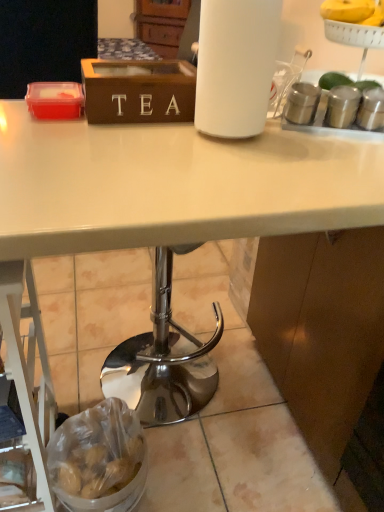
Question: From their relative heights in the image, would you say wooden tea box at upper center is taller or shorter than translucent plastic bag of potatoes at lower left?

Choices:
 (A) short
 (B) tall

Answer: (A)

Question: Is wooden tea box at upper center inside the boundaries of translucent plastic bag of potatoes at lower left, or outside?

Choices:
 (A) outside
 (B) inside

Answer: (A)

Question: Is wooden tea box at upper center wider or thinner than translucent plastic bag of potatoes at lower left?

Choices:
 (A) wide
 (B) thin

Answer: (B)

Question: Is translucent plastic bag of potatoes at lower left situated inside wooden tea box at upper center or outside?

Choices:
 (A) inside
 (B) outside

Answer: (B)

Question: Visually, is translucent plastic bag of potatoes at lower left positioned to the left or to the right of wooden tea box at upper center?

Choices:
 (A) right
 (B) left

Answer: (B)

Question: Is translucent plastic bag of potatoes at lower left taller or shorter than wooden tea box at upper center?

Choices:
 (A) short
 (B) tall

Answer: (B)

Question: Is translucent plastic bag of potatoes at lower left wider or thinner than wooden tea box at upper center?

Choices:
 (A) thin
 (B) wide

Answer: (B)